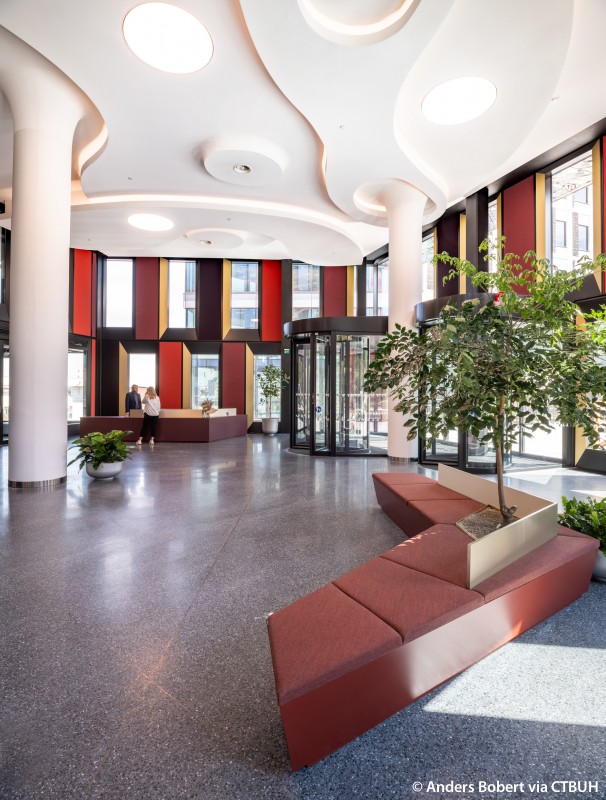
Find the location of a particular element. desk is located at coordinates (125, 417).